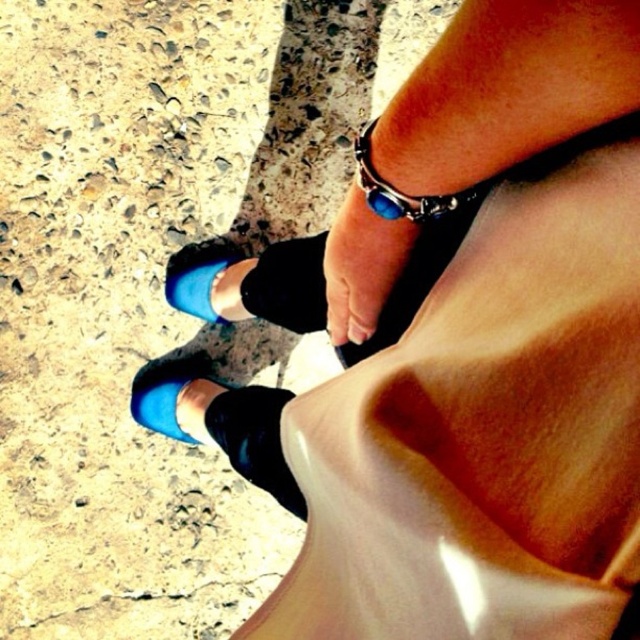
Question: Which object is closer to the camera taking this photo?

Choices:
 (A) blue stone bracelet at upper center
 (B) blue suede shoe at lower center
 (C) blue suede sandal at lower left
 (D) black leather ankle at lower center

Answer: (A)

Question: Does blue suede sandal at lower left appear on the left side of blue suede shoe at lower center?

Choices:
 (A) yes
 (B) no

Answer: (A)

Question: Which object is farther from the camera taking this photo?

Choices:
 (A) blue suede sandal at lower left
 (B) blue suede shoe at lower center
 (C) blue stone bracelet at upper center

Answer: (B)

Question: Can you confirm if blue suede shoe at lower center is positioned below blue stone bracelet at upper center?

Choices:
 (A) no
 (B) yes

Answer: (A)

Question: Which point appears closest to the camera in this image?

Choices:
 (A) (177, 272)
 (B) (282, 499)
 (C) (193, 428)

Answer: (B)

Question: Does black leather ankle at lower center appear over blue suede sandal at lower left?

Choices:
 (A) yes
 (B) no

Answer: (B)